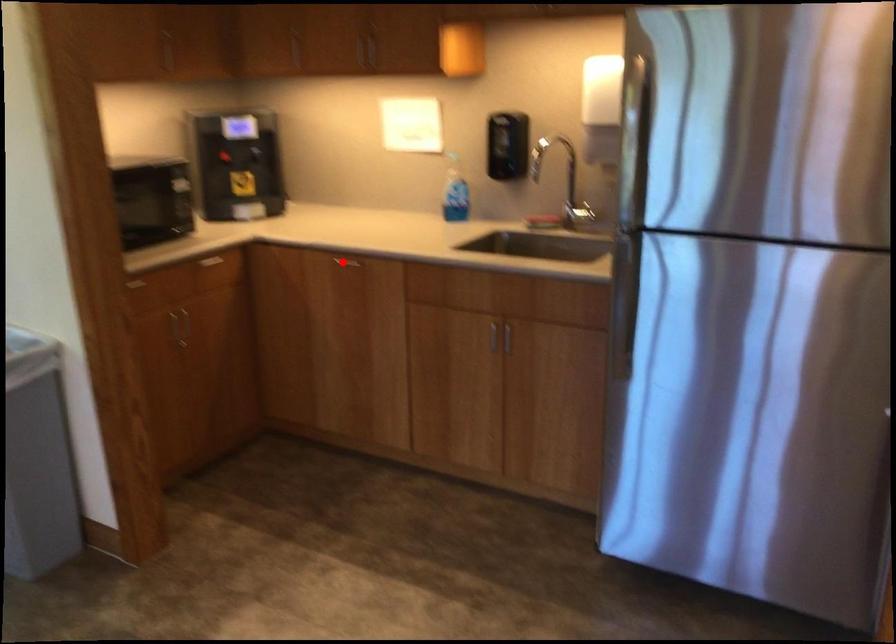
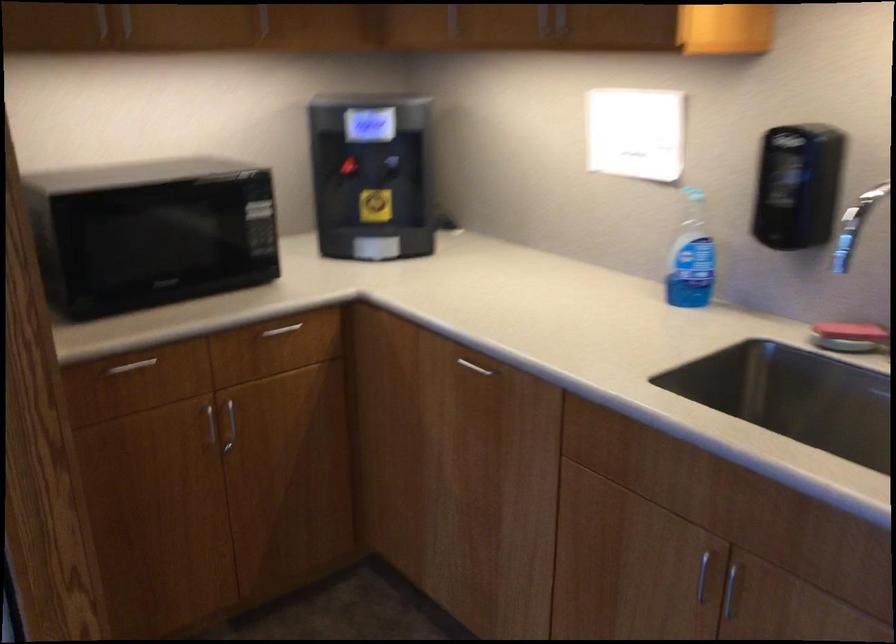
Locate, in the second image, the point that corresponds to the highlighted location in the first image.

(475, 366)